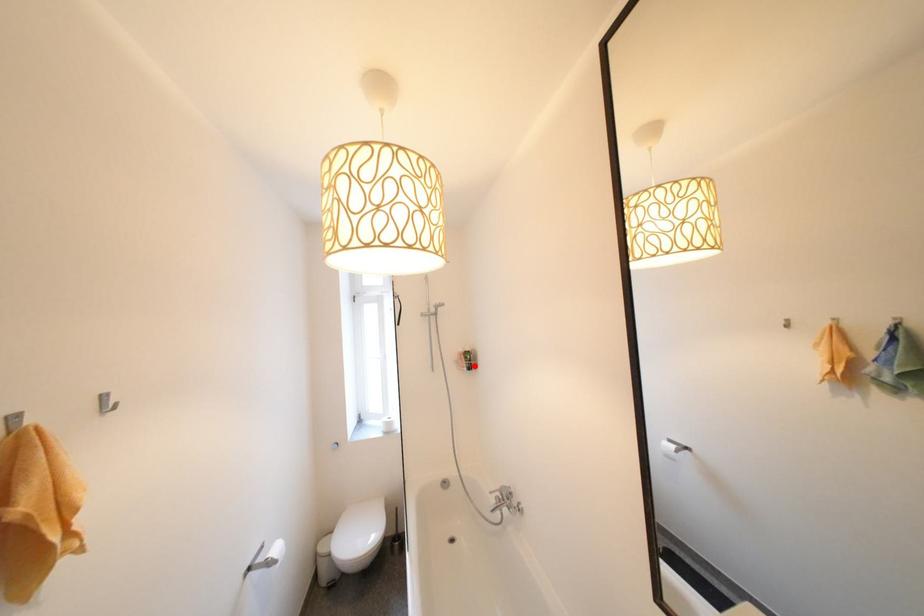
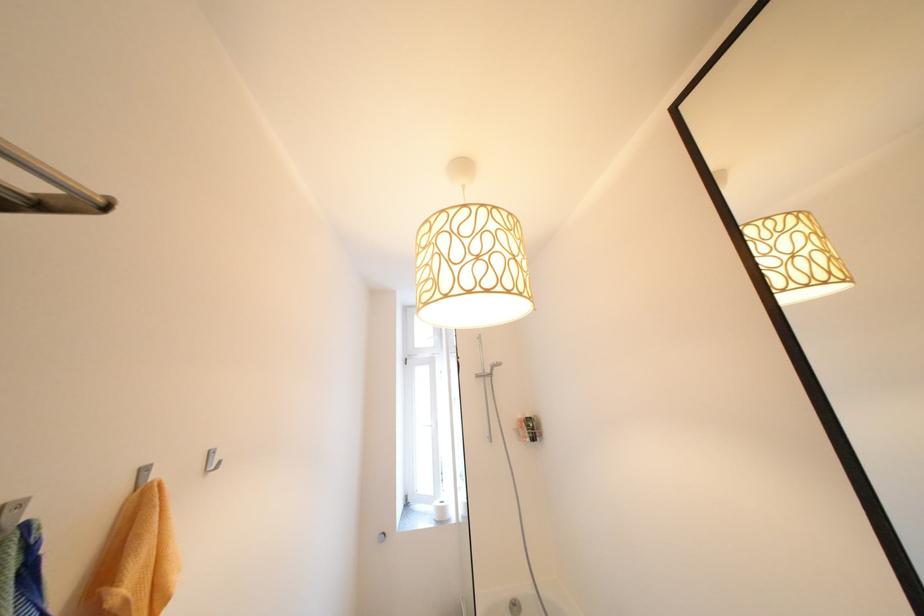
Locate, in the second image, the point that corresponds to the highlighted location in the first image.

(537, 436)